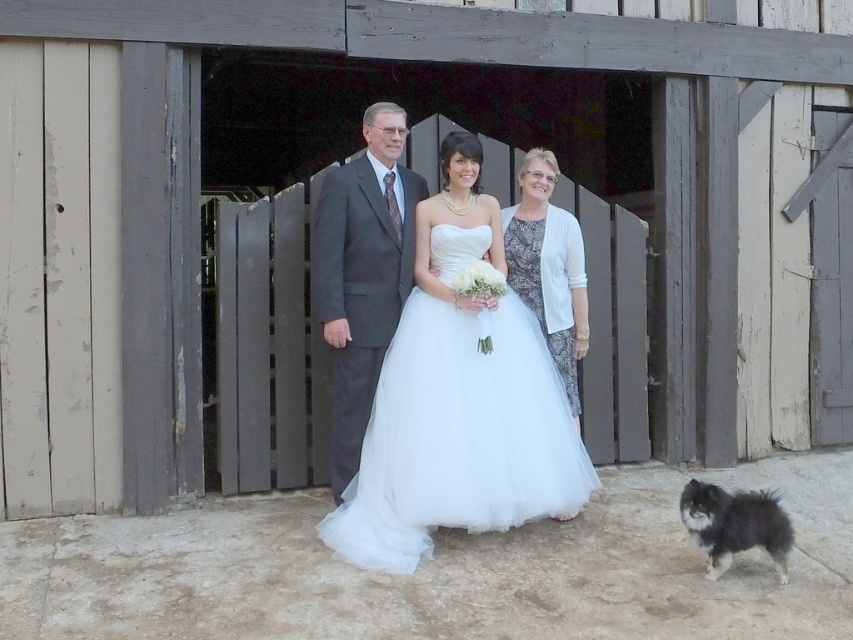
You are a photographer at the wedding. You need to adjust the camera focus to ensure both the dark gray suit at center and the fluffy black fur dog at lower right are in focus. Given their sizes, which one requires a closer focus adjustment?

The dark gray suit at center is larger in size than the fluffy black fur dog at lower right, so the photographer should focus closer on the fluffy black fur dog at lower right to ensure both are in focus.

You are a photographer at a wedding. You need to capture a closeup shot of the bride in her white tulle wedding dress at center and the white textured dress at center. The camera you are using has a maximum focus range of 50 centimeters. Will you be able to capture both dresses in focus without moving the camera?

The white tulle wedding dress at center and white textured dress at center are 57.78 centimeters apart from each other. Since the camera has a maximum focus range of 50 centimeters, the distance between the dresses exceeds this limit. Therefore, you will not be able to capture both dresses in focus without adjusting the camera position or settings.

In the wedding scene, there is a dark gray suit at center and a fluffy black fur dog at lower right. From the perspective of someone standing in front of the bride, which object is closer to the front of the scene?

The dark gray suit at center is positioned over the fluffy black fur dog at lower right, meaning the dark gray suit at center is closer to the front of the scene.